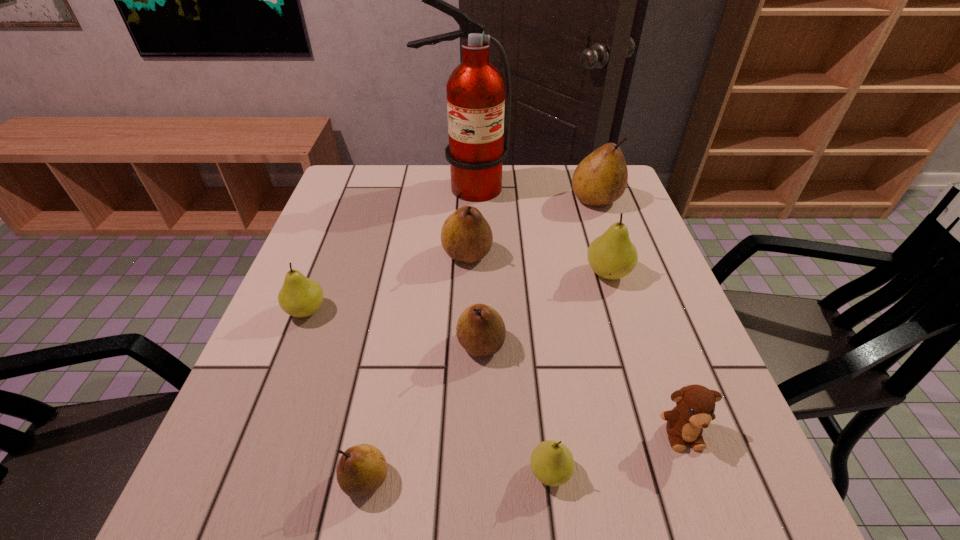
Locate an element on the screen. The height and width of the screenshot is (540, 960). the second pear from left to right is located at coordinates (362, 469).

Locate an element on the screen. the smallest brown pear is located at coordinates (362, 469).

This screenshot has height=540, width=960. What are the coordinates of `the nearest green pear` in the screenshot? It's located at (552, 463).

This screenshot has width=960, height=540. Find the location of `the fifth pear from left to right`. the fifth pear from left to right is located at coordinates (552, 463).

Locate an element on the screen. The width and height of the screenshot is (960, 540). vacant space located 0.200m on the nozzle and handle of the fire extinguisher is located at coordinates (462, 249).

Find the location of a particular element. This screenshot has width=960, height=540. vacant region located 0.130m on the back of the farthest brown pear is located at coordinates (584, 165).

At what (x,y) coordinates should I click in order to perform the action: click on free point located 0.210m on the right of the third nearest brown pear. Please return your answer as a coordinate pair (x, y). The height and width of the screenshot is (540, 960). Looking at the image, I should click on (578, 254).

This screenshot has height=540, width=960. Identify the location of vacant space situated on the front of the farthest green pear. (634, 354).

At what (x,y) coordinates should I click in order to perform the action: click on free space located on the back of the leftmost pear. Please return your answer as a coordinate pair (x, y). Looking at the image, I should click on (333, 242).

I want to click on free space located 0.350m on the right of the third biggest brown pear, so click(x=680, y=345).